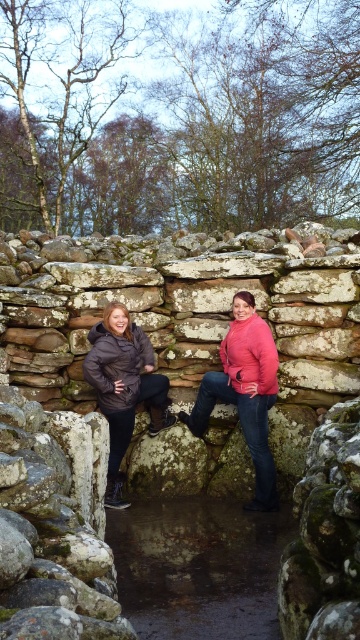
Question: From the image, what is the correct spatial relationship of brown mossy creek at center in relation to matte brown jacket at center?

Choices:
 (A) above
 (B) below

Answer: (B)

Question: Which object appears closest to the camera in this image?

Choices:
 (A) brown mossy creek at center
 (B) matte brown jacket at center
 (C) matte black jacket at center

Answer: (A)

Question: Can you confirm if matte black jacket at center is thinner than matte brown jacket at center?

Choices:
 (A) yes
 (B) no

Answer: (B)

Question: Based on their relative distances, which object is nearer to the matte brown jacket at center?

Choices:
 (A) brown mossy creek at center
 (B) lichen-covered stone at center

Answer: (B)

Question: Does brown mossy creek at center appear on the right side of matte brown jacket at center?

Choices:
 (A) no
 (B) yes

Answer: (B)

Question: Considering the real-world distances, which object is farthest from the matte black jacket at center?

Choices:
 (A) brown mossy creek at center
 (B) matte brown jacket at center

Answer: (A)